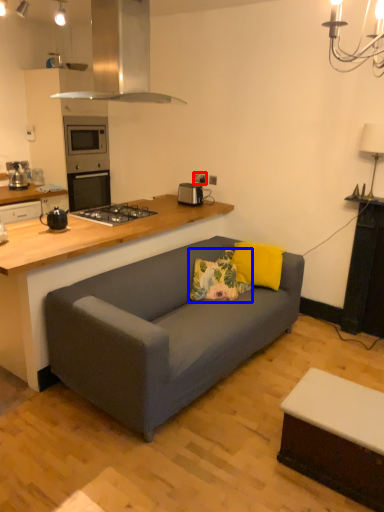
Question: Among these objects, which one is nearest to the camera, electric outlet (highlighted by a red box) or pillow (highlighted by a blue box)?

Choices:
 (A) electric outlet
 (B) pillow

Answer: (B)